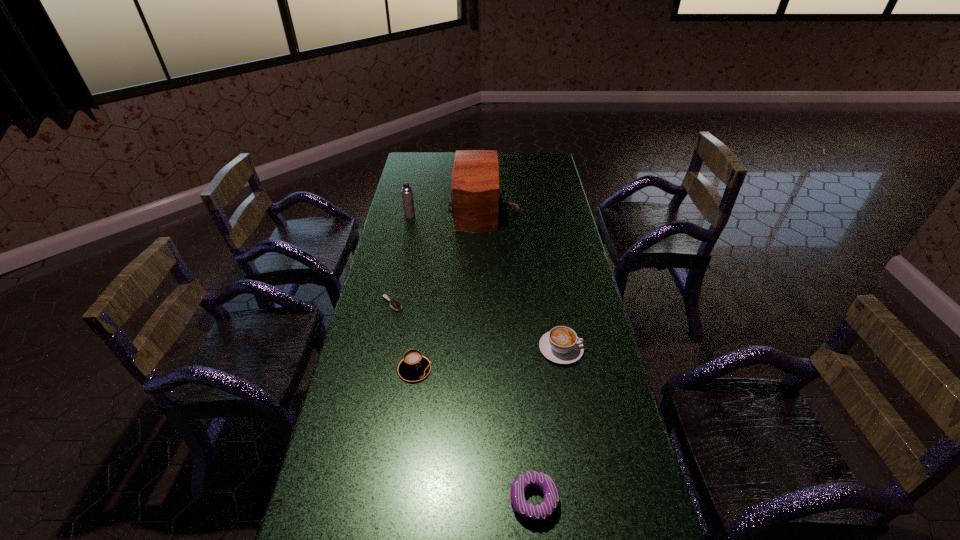
Identify the location of empty location between the shortest object and the nearest object. Image resolution: width=960 pixels, height=540 pixels. (463, 402).

Find the location of a particular element. This screenshot has width=960, height=540. free spot between the rightmost object and the thermos bottle is located at coordinates (486, 282).

Locate an element on the screen. Image resolution: width=960 pixels, height=540 pixels. free point between the rightmost object and the third object from left to right is located at coordinates (488, 359).

This screenshot has width=960, height=540. What are the coordinates of `free point between the fourth object from right to left and the second shortest object` in the screenshot? It's located at (474, 435).

Where is `object that stands as the fifth closest to the radio receiver`? This screenshot has width=960, height=540. object that stands as the fifth closest to the radio receiver is located at coordinates (533, 513).

Identify the location of object that is the fourth closest to the shortest object. (407, 195).

Where is `vacant position in the image that satisfies the following two spatial constraints: 1. on the front side of the left cappuccino; 2. on the left side of the doughnut`? This screenshot has height=540, width=960. vacant position in the image that satisfies the following two spatial constraints: 1. on the front side of the left cappuccino; 2. on the left side of the doughnut is located at coordinates (397, 500).

Locate an element on the screen. The image size is (960, 540). free location that satisfies the following two spatial constraints: 1. on the front side of the fourth nearest object; 2. on the left side of the nearest object is located at coordinates (350, 500).

The width and height of the screenshot is (960, 540). In order to click on vacant point that satisfies the following two spatial constraints: 1. on the front-facing side of the fifth tallest object; 2. on the left side of the tallest object in this screenshot , I will do `click(489, 500)`.